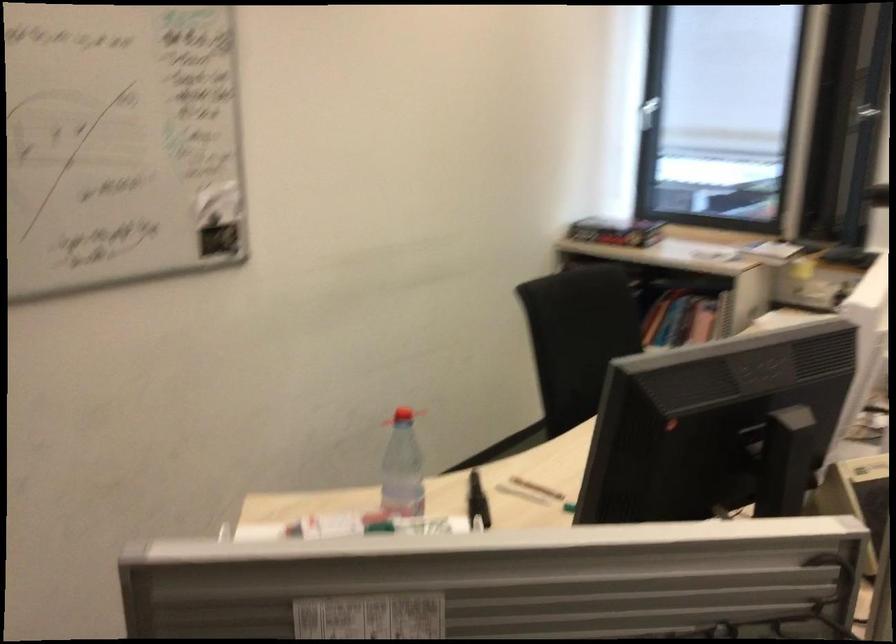
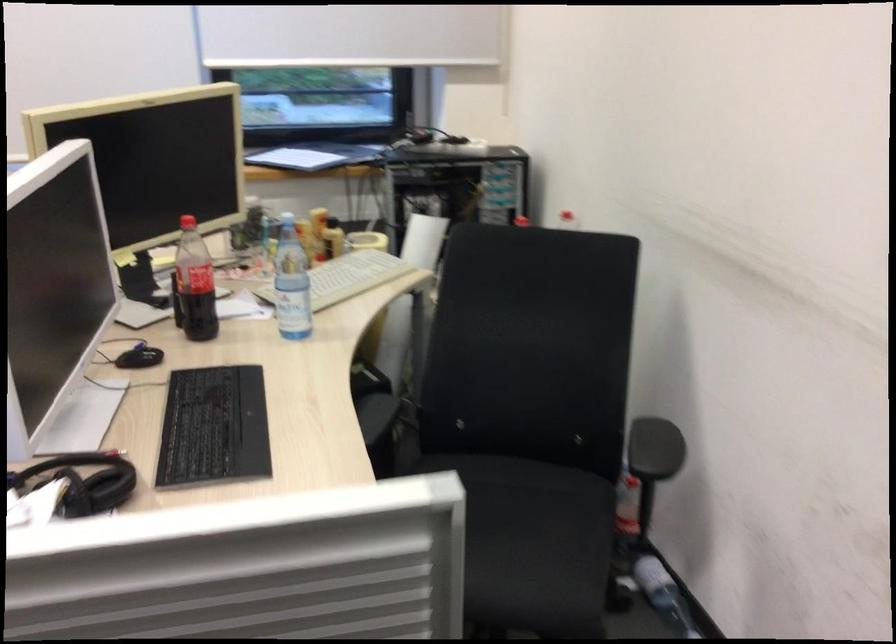
Question: The first image is from the beginning of the video and the second image is from the end. How did the camera likely rotate when shooting the video?

Choices:
 (A) Left
 (B) Right
 (C) Up
 (D) Down

Answer: (B)